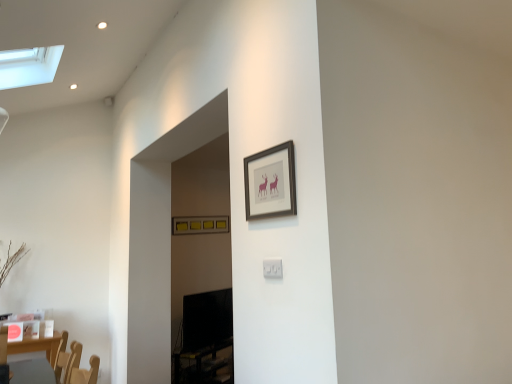
Question: Is matte black frame at upper center, which is counted as the 2th picture frame, starting from the back, facing away from white plastic electric outlet at center?

Choices:
 (A) no
 (B) yes

Answer: (A)

Question: From the image's perspective, is matte black frame at upper center, the first picture frame from the right, on top of white plastic electric outlet at center?

Choices:
 (A) no
 (B) yes

Answer: (B)

Question: Does matte black frame at upper center, the 2th picture frame when ordered from left to right, appear on the left side of white plastic electric outlet at center?

Choices:
 (A) yes
 (B) no

Answer: (A)

Question: Is matte black frame at upper center, placed as the 1th picture frame when sorted from front to back, wider than white plastic electric outlet at center?

Choices:
 (A) yes
 (B) no

Answer: (A)

Question: Can you confirm if matte black frame at upper center, which ranks as the first picture frame in top-to-bottom order, is smaller than white plastic electric outlet at center?

Choices:
 (A) no
 (B) yes

Answer: (A)

Question: Considering the relative positions of matte yellow picture frame at upper center, which is the second picture frame in front-to-back order, and white plastic electric outlet at center in the image provided, is matte yellow picture frame at upper center, which is the second picture frame in front-to-back order, to the left or to the right of white plastic electric outlet at center?

Choices:
 (A) right
 (B) left

Answer: (B)

Question: From the image's perspective, is matte yellow picture frame at upper center, the first picture frame from the left, above or below white plastic electric outlet at center?

Choices:
 (A) above
 (B) below

Answer: (B)

Question: From a real-world perspective, is matte yellow picture frame at upper center, which is the second picture frame from right to left, above or below white plastic electric outlet at center?

Choices:
 (A) above
 (B) below

Answer: (A)

Question: Is point (175, 221) positioned closer to the camera than point (271, 264)?

Choices:
 (A) farther
 (B) closer

Answer: (A)

Question: From a real-world perspective, is matte black frame at upper center, the first picture frame from the right, above or below white plastic electric outlet at center?

Choices:
 (A) above
 (B) below

Answer: (A)

Question: From the image's perspective, is matte black frame at upper center, the first picture frame from the right, above or below white plastic electric outlet at center?

Choices:
 (A) above
 (B) below

Answer: (A)

Question: Visually, is matte black frame at upper center, the 2th picture frame when ordered from left to right, positioned to the left or to the right of white plastic electric outlet at center?

Choices:
 (A) right
 (B) left

Answer: (B)

Question: Does point (254, 157) appear closer or farther from the camera than point (267, 271)?

Choices:
 (A) farther
 (B) closer

Answer: (A)

Question: Is white plastic electric outlet at center situated inside matte black frame at upper center, the first picture frame from the right, or outside?

Choices:
 (A) inside
 (B) outside

Answer: (B)

Question: From a real-world perspective, is white plastic electric outlet at center above or below matte black frame at upper center, which ranks as the first picture frame in top-to-bottom order?

Choices:
 (A) below
 (B) above

Answer: (A)